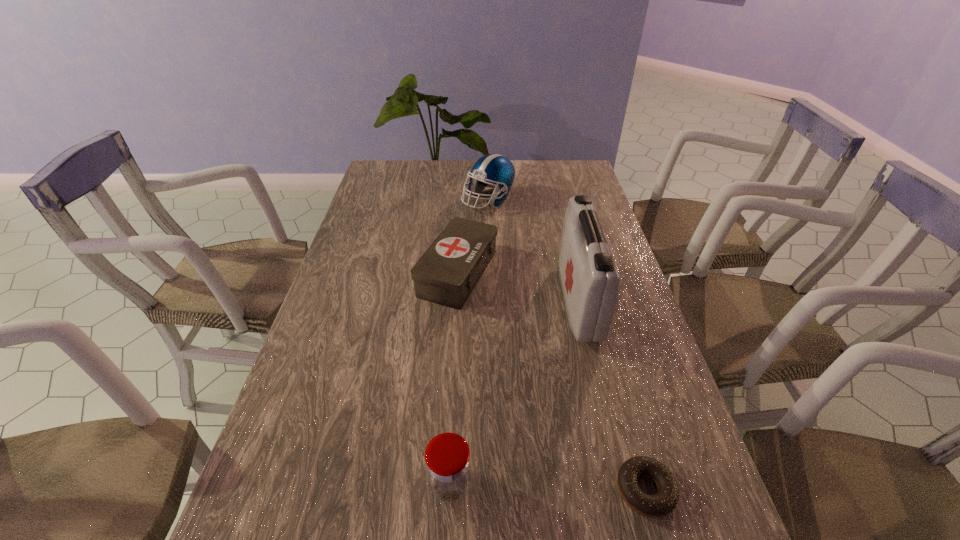
Identify the location of free space between the football helmet and the shortest object. (566, 345).

Find the location of a particular element. The height and width of the screenshot is (540, 960). free space between the tallest object and the football helmet is located at coordinates (534, 250).

This screenshot has width=960, height=540. I want to click on object that stands as the fourth closest to the left first-aid kit, so click(662, 503).

Point out which object is positioned as the nearest to the jar. Please provide its 2D coordinates. Your answer should be formatted as a tuple, i.e. [(x, y)], where the tuple contains the x and y coordinates of a point satisfying the conditions above.

[(662, 503)]

Find the location of a particular element. The height and width of the screenshot is (540, 960). blank space that satisfies the following two spatial constraints: 1. on the back side of the shortest object; 2. on the front side of the right first-aid kit is located at coordinates (593, 301).

Find the location of a particular element. vacant space that satisfies the following two spatial constraints: 1. on the front side of the right first-aid kit; 2. on the left side of the doughnut is located at coordinates (624, 490).

You are a GUI agent. You are given a task and a screenshot of the screen. Output one action in this format:
    pyautogui.click(x=<x>, y=<y>)
    Task: Click on the vacant area in the image that satisfies the following two spatial constraints: 1. on the front side of the doughnut; 2. on the right side of the taller first-aid kit
    This screenshot has height=540, width=960.
    Given the screenshot: What is the action you would take?
    pyautogui.click(x=624, y=490)

Locate an element on the screen. The height and width of the screenshot is (540, 960). free space in the image that satisfies the following two spatial constraints: 1. at the front of the doughnut with the faceguard; 2. on the left side of the football helmet is located at coordinates tap(496, 490).